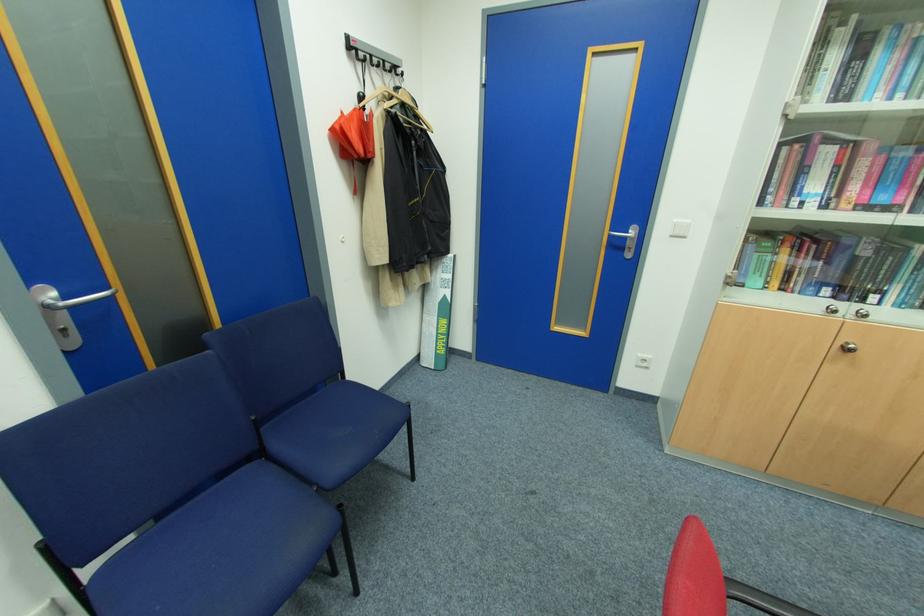
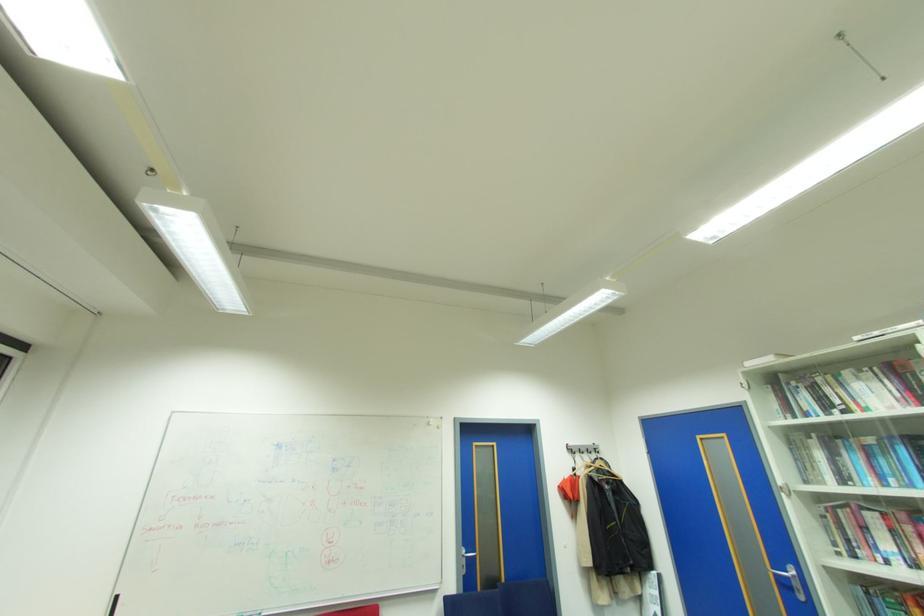
Locate, in the second image, the point that corresponds to pixel 891 30 in the first image.

(843, 442)